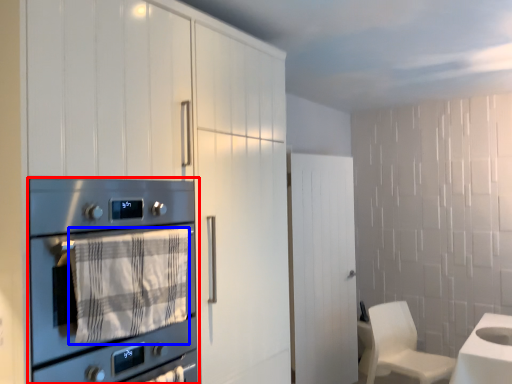
Question: Which object is further to the camera taking this photo, home appliance (highlighted by a red box) or blanket (highlighted by a blue box)?

Choices:
 (A) home appliance
 (B) blanket

Answer: (B)